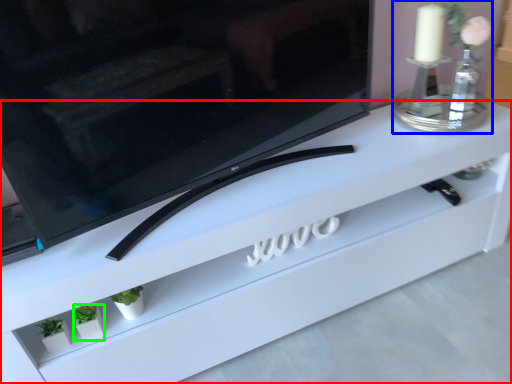
Question: Which object is the farthest from furniture (highlighted by a red box)? Choose among these: candle holder (highlighted by a blue box) or plant (highlighted by a green box).

Choices:
 (A) candle holder
 (B) plant

Answer: (B)